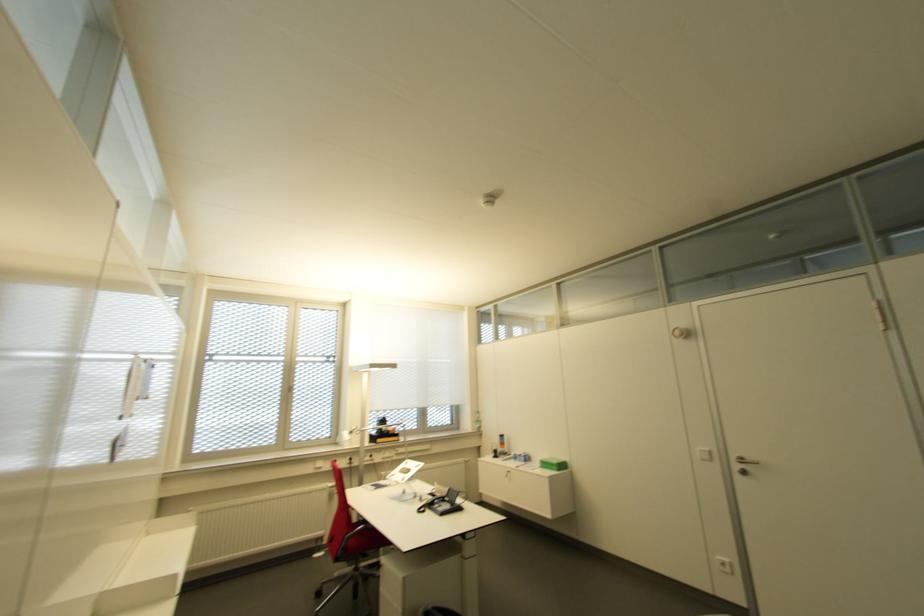
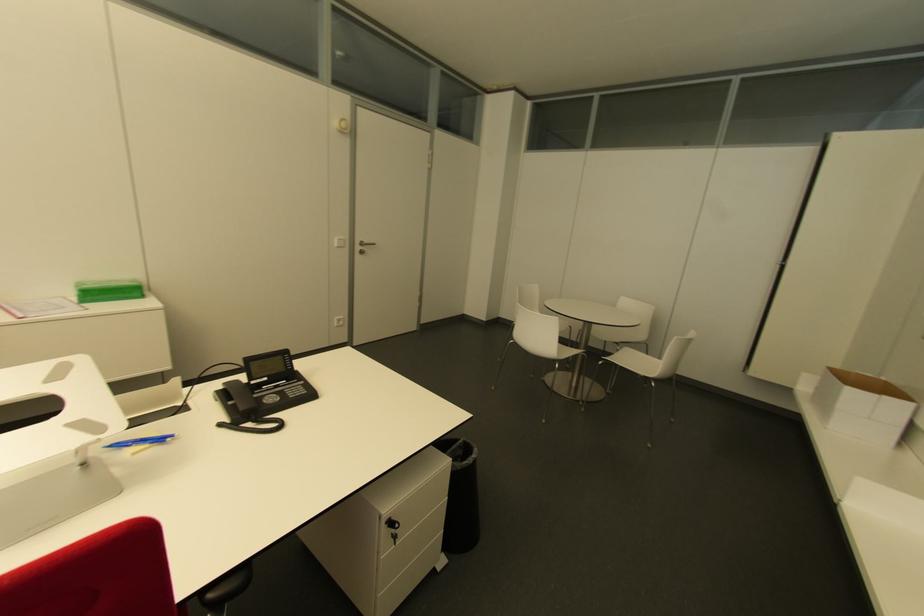
Where in the second image is the point corresponding to point 743,474 from the first image?

(360, 253)